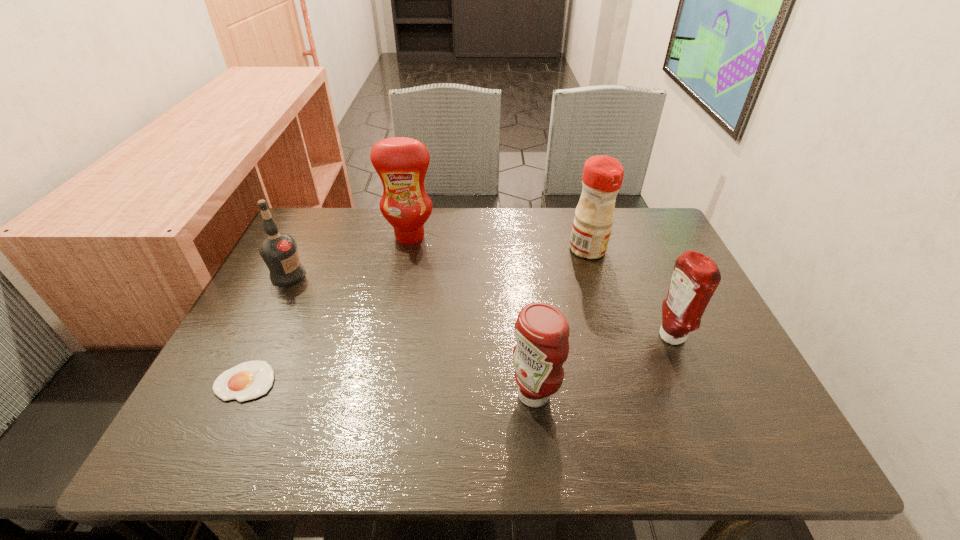
In order to click on vacant region located on the front label of the third farthest object in this screenshot , I will do `click(448, 275)`.

Find the location of a particular element. Image resolution: width=960 pixels, height=540 pixels. vacant space located 0.210m on the left of the rightmost condiment is located at coordinates (564, 337).

Identify the location of vacant region located on the back of the nearest condiment. The width and height of the screenshot is (960, 540). (528, 345).

Where is `free space located 0.090m on the back of the shortest object`? The height and width of the screenshot is (540, 960). free space located 0.090m on the back of the shortest object is located at coordinates (270, 330).

This screenshot has height=540, width=960. I want to click on object that is at the near edge, so click(x=541, y=331).

Identify the location of vodka situated at the left edge. (279, 251).

Where is `egg yolk that is at the left edge`? The width and height of the screenshot is (960, 540). egg yolk that is at the left edge is located at coordinates (249, 380).

I want to click on object located at the right edge, so click(695, 277).

Identify the location of vacant space at the far edge. The height and width of the screenshot is (540, 960). (451, 231).

This screenshot has height=540, width=960. I want to click on vacant space at the left edge of the desktop, so click(x=283, y=379).